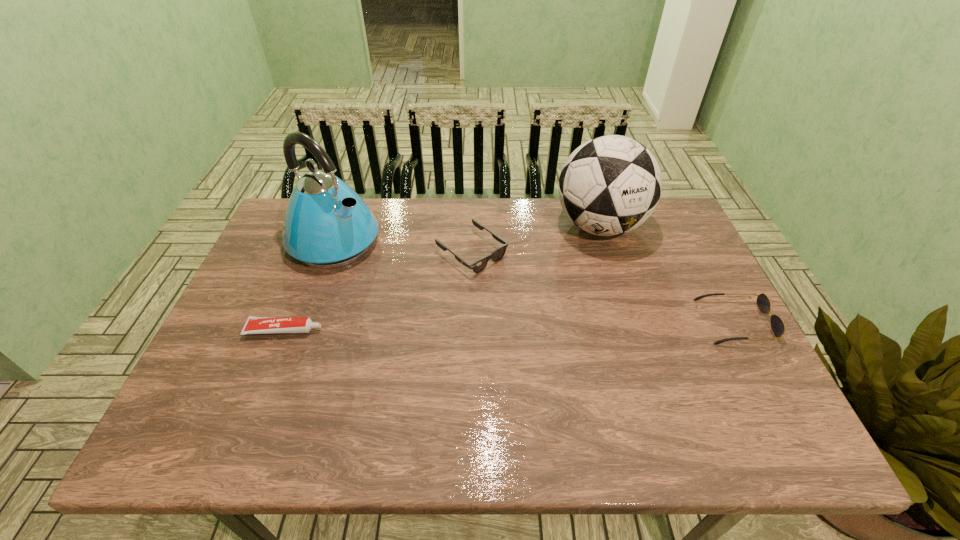
I want to click on free space between the tallest object and the nearer sunglasses, so click(535, 282).

The image size is (960, 540). I want to click on vacant area that lies between the right sunglasses and the left sunglasses, so pos(603,287).

Select which object is the third closest to the farther sunglasses. Please provide its 2D coordinates. Your answer should be formatted as a tuple, i.e. [(x, y)], where the tuple contains the x and y coordinates of a point satisfying the conditions above.

[(254, 325)]

Identify which object is located as the second nearest to the soccer ball. Please provide its 2D coordinates. Your answer should be formatted as a tuple, i.e. [(x, y)], where the tuple contains the x and y coordinates of a point satisfying the conditions above.

[(778, 327)]

You are a GUI agent. You are given a task and a screenshot of the screen. Output one action in this format:
    pyautogui.click(x=<x>, y=<y>)
    Task: Click on the free space in the image that satisfies the following two spatial constraints: 1. on the front side of the right sunglasses; 2. on the front-facing side of the farther sunglasses
    This screenshot has width=960, height=540.
    Given the screenshot: What is the action you would take?
    (x=470, y=322)

Locate an element on the screen. The image size is (960, 540). vacant region that satisfies the following two spatial constraints: 1. on the back side of the kettle; 2. on the right side of the second object from right to left is located at coordinates (340, 226).